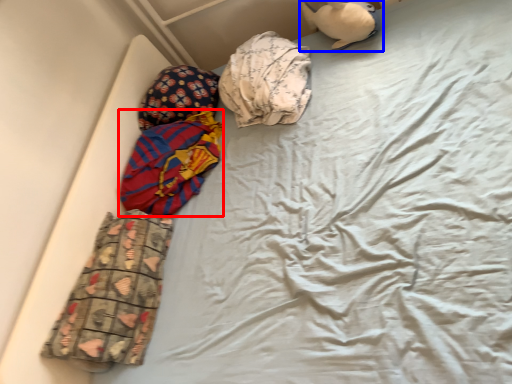
Question: Which point is closer to the camera, material (highlighted by a red box) or toy (highlighted by a blue box)?

Choices:
 (A) material
 (B) toy

Answer: (A)